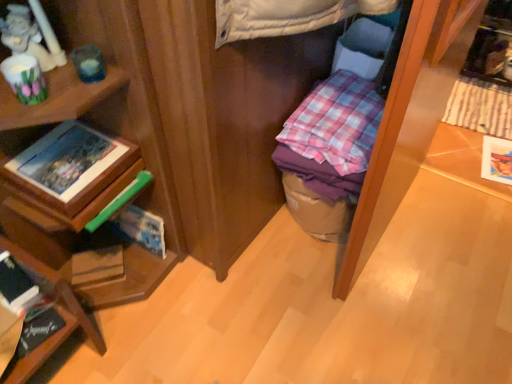
Question: Is wooden photo frame at left, acting as the third book starting from the bottom, thinner than hardcover book at lower left, the 2th book in the bottom-to-top sequence?

Choices:
 (A) yes
 (B) no

Answer: (B)

Question: Is wooden photo frame at left, arranged as the 1th book when viewed from the top, not near hardcover book at lower left, the 2th book in the bottom-to-top sequence?

Choices:
 (A) yes
 (B) no

Answer: (B)

Question: From the image's perspective, is wooden photo frame at left, acting as the third book starting from the bottom, below hardcover book at lower left, the 2th book in the bottom-to-top sequence?

Choices:
 (A) no
 (B) yes

Answer: (A)

Question: Is the depth of wooden photo frame at left, acting as the third book starting from the bottom, greater than that of hardcover book at lower left, the 2th book in the bottom-to-top sequence?

Choices:
 (A) yes
 (B) no

Answer: (A)

Question: Considering the relative sizes of wooden photo frame at left, acting as the third book starting from the bottom, and hardcover book at lower left, the 2th book in the top-to-bottom sequence, in the image provided, is wooden photo frame at left, acting as the third book starting from the bottom, wider than hardcover book at lower left, the 2th book in the top-to-bottom sequence,?

Choices:
 (A) no
 (B) yes

Answer: (B)

Question: Is hardcover book at lower left, the third book when ordered from top to bottom, wider or thinner than matte brown book at lower left, which ranks as the first paperback book in bottom-to-top order?

Choices:
 (A) wide
 (B) thin

Answer: (A)

Question: Considering the positions of point (39, 339) and point (108, 264), is point (39, 339) closer or farther from the camera than point (108, 264)?

Choices:
 (A) closer
 (B) farther

Answer: (A)

Question: In the image, is hardcover book at lower left, which is the first book from bottom to top, positioned in front of or behind matte brown book at lower left, which is the first paperback book from left to right?

Choices:
 (A) front
 (B) behind

Answer: (A)

Question: From a real-world perspective, is hardcover book at lower left, the third book when ordered from top to bottom, physically located above or below matte brown book at lower left, which is the 3th paperback book in right-to-left order?

Choices:
 (A) above
 (B) below

Answer: (A)

Question: Would you say wooden bookshelf at lower left is inside or outside hardcover book at lower left, the 2th book in the bottom-to-top sequence?

Choices:
 (A) inside
 (B) outside

Answer: (B)

Question: Looking at their shapes, would you say wooden bookshelf at lower left is wider or thinner than hardcover book at lower left, the 2th book in the bottom-to-top sequence?

Choices:
 (A) thin
 (B) wide

Answer: (B)

Question: From the image's perspective, is wooden bookshelf at lower left located above or below hardcover book at lower left, the 2th book in the top-to-bottom sequence?

Choices:
 (A) below
 (B) above

Answer: (A)

Question: Relative to hardcover book at lower left, the 2th book in the top-to-bottom sequence, is wooden bookshelf at lower left in front or behind?

Choices:
 (A) front
 (B) behind

Answer: (A)

Question: From the image's perspective, relative to pink checkered fabric at center, is matte brown book at lower left, the 3th paperback book when ordered from top to bottom, above or below?

Choices:
 (A) below
 (B) above

Answer: (A)

Question: Considering the positions of matte brown book at lower left, which ranks as the first paperback book in bottom-to-top order, and pink checkered fabric at center in the image, is matte brown book at lower left, which ranks as the first paperback book in bottom-to-top order, taller or shorter than pink checkered fabric at center?

Choices:
 (A) tall
 (B) short

Answer: (B)